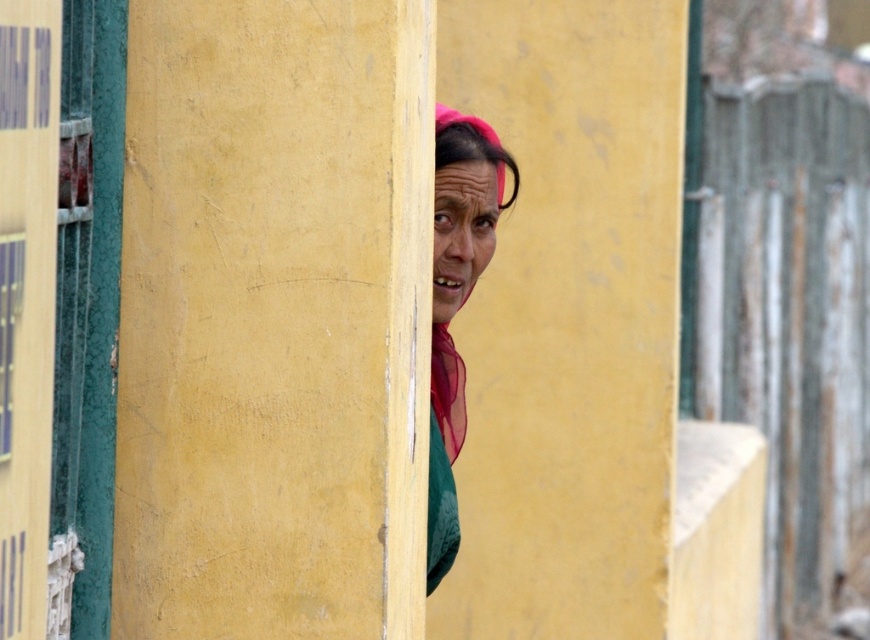
You are an interior designer trying to decide which accessory to place on a shelf between the pink sheer scarf at center and the translucent pink shawl at center. Which one takes up more space?

The pink sheer scarf at center is bigger than the translucent pink shawl at center, so it takes up more space.

You are an interior designer observing the scene. You notice the translucent pink shawl at center and the pink fabric headscarf at center. Which item is located lower in the image?

The translucent pink shawl at center is positioned under the pink fabric headscarf at center, so it is lower in the image.

You are an interior designer assessing the decor of this space. You notice the pink sheer scarf at center and the translucent pink shawl at center. Which of these two items is taller?

The pink sheer scarf at center is taller than the translucent pink shawl at center.